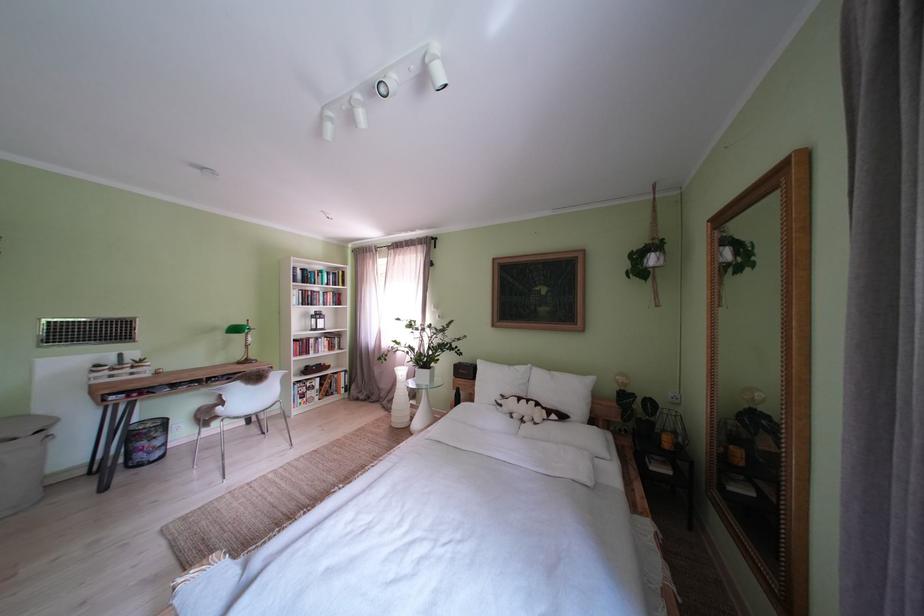
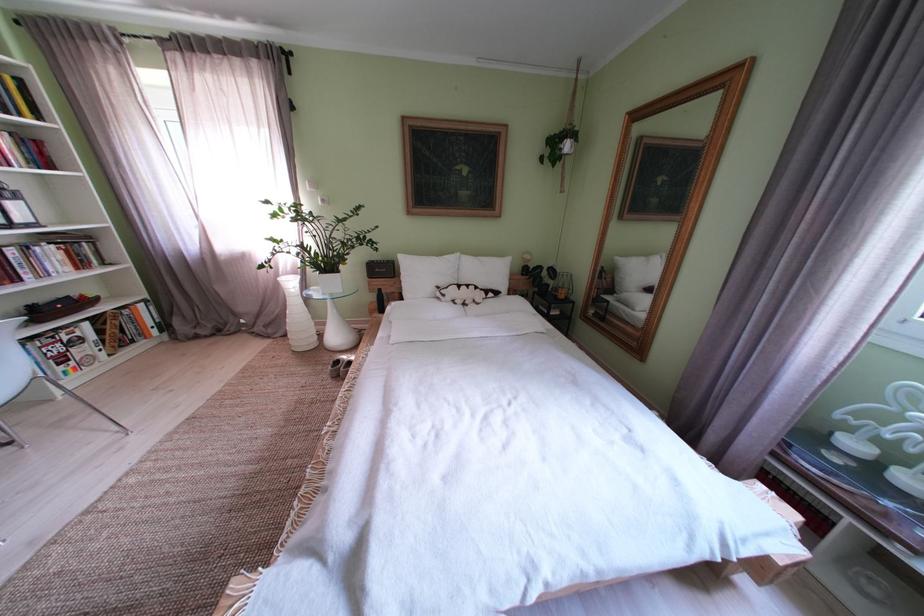
Locate, in the second image, the point that corresponds to (x=512, y=411) in the first image.

(455, 301)